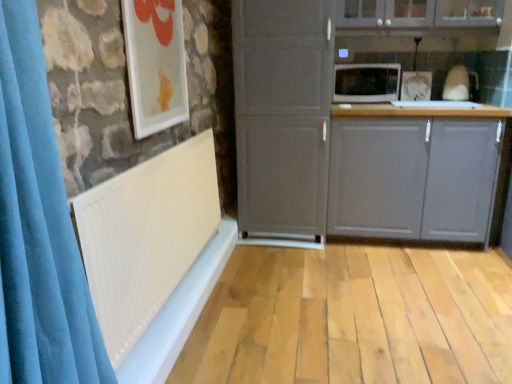
The height and width of the screenshot is (384, 512). I want to click on free space in front of matte gray cabinet at center, which is the second cabinetry from top to bottom, so click(417, 281).